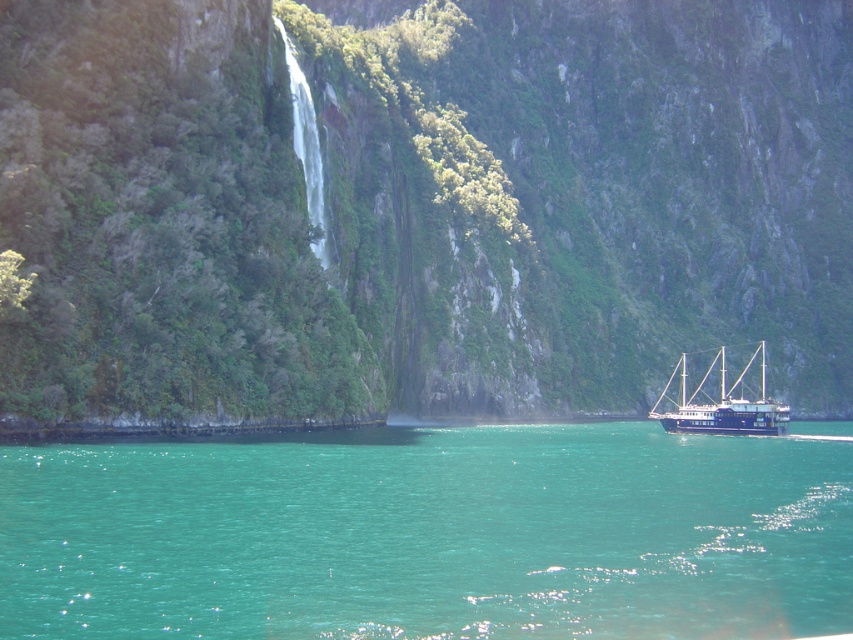
Question: Which object is the farthest from the green mossy cliff at center?

Choices:
 (A) teal glossy water at center
 (B) dark blue wooden ship at lower right

Answer: (A)

Question: Can you confirm if green mossy cliff at center is positioned to the left of dark blue wooden ship at lower right?

Choices:
 (A) no
 (B) yes

Answer: (B)

Question: Observing the image, what is the correct spatial positioning of green mossy cliff at center in reference to teal glossy water at center?

Choices:
 (A) right
 (B) left

Answer: (A)

Question: Which of these objects is positioned farthest from the teal glossy water at center?

Choices:
 (A) green mossy cliff at center
 (B) dark blue wooden ship at lower right

Answer: (A)

Question: Which object is the farthest from the dark blue wooden ship at lower right?

Choices:
 (A) teal glossy water at center
 (B) green mossy cliff at center

Answer: (A)

Question: Considering the relative positions of green mossy cliff at center and dark blue wooden ship at lower right in the image provided, where is green mossy cliff at center located with respect to dark blue wooden ship at lower right?

Choices:
 (A) left
 (B) right

Answer: (A)